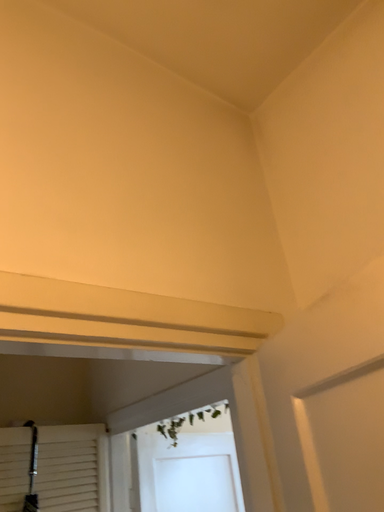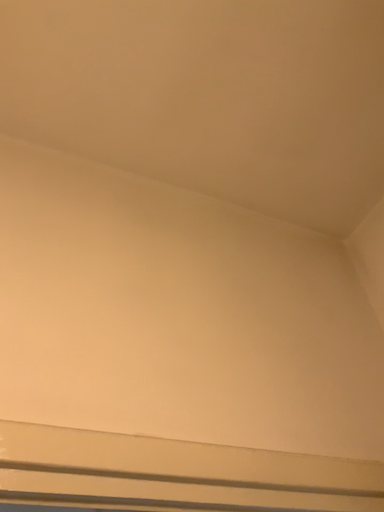
Question: Which way did the camera rotate in the video?

Choices:
 (A) rotated left
 (B) rotated right

Answer: (A)